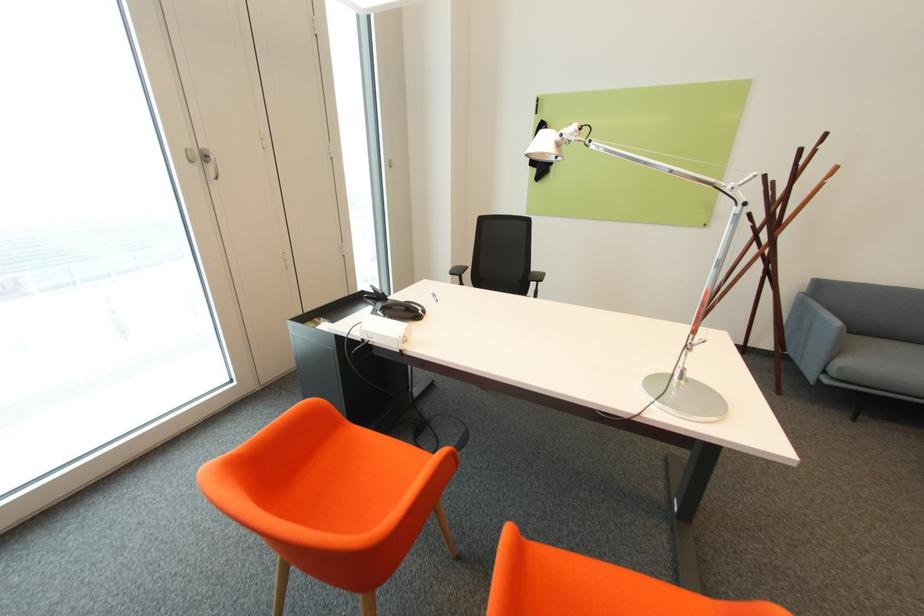
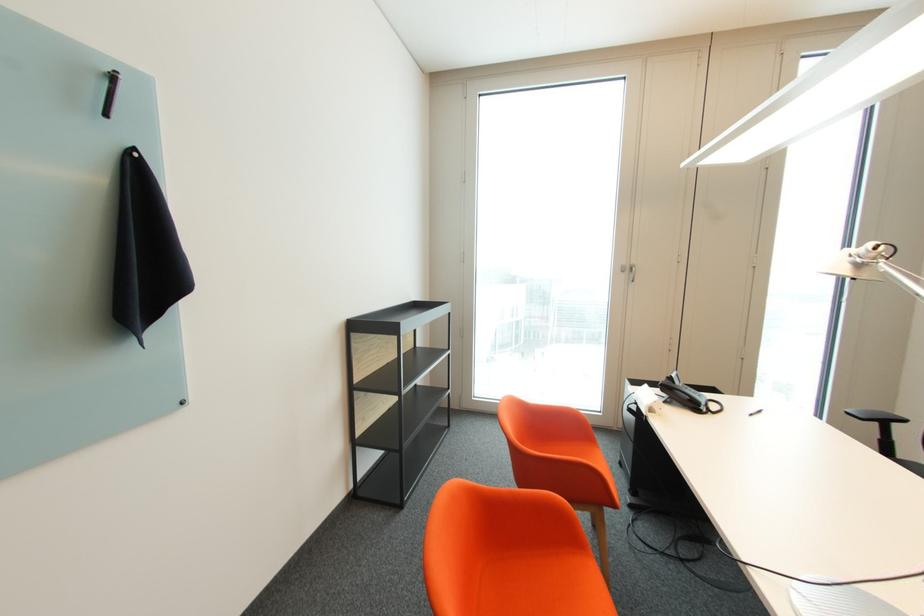
The point at (x=198, y=161) is marked in the first image. Where is the corresponding point in the second image?

(629, 272)